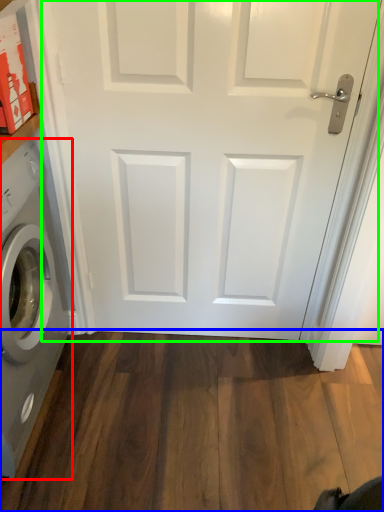
Question: Which object is the farthest from washing machine (highlighted by a red box)? Choose among these: hardwood (highlighted by a blue box) or door (highlighted by a green box).

Choices:
 (A) hardwood
 (B) door

Answer: (A)